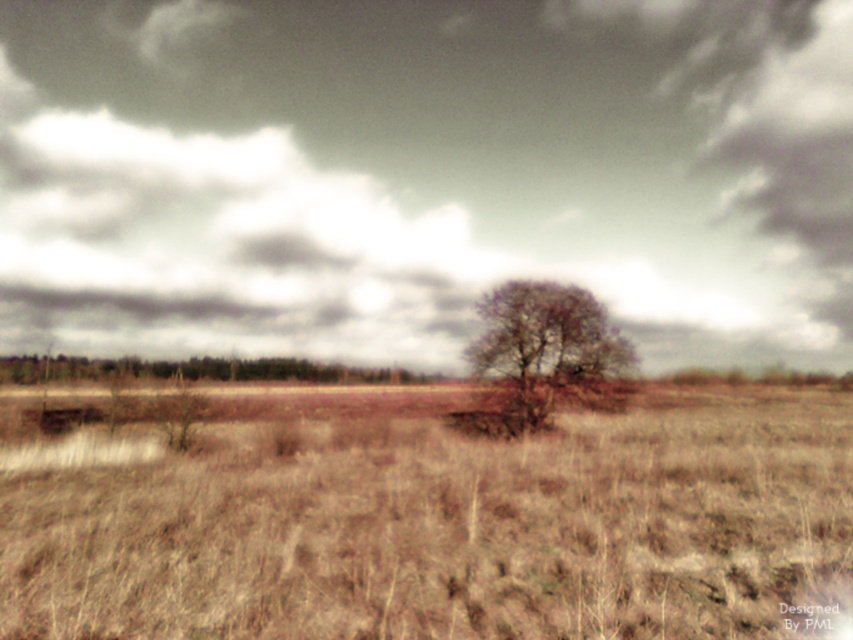
You are a photographer aiming to capture the brown textured tree at center and the brown matte tree at center in a single shot. Based on their positions, which tree appears closer to the camera?

The brown textured tree at center appears closer to the camera because it is positioned above the brown matte tree at center, indicating it is in a higher plane of focus.